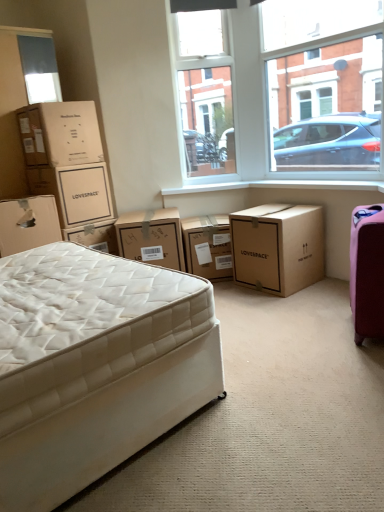
Question: Is white quilted mattress at lower left thinner than white smooth window sill at center?

Choices:
 (A) no
 (B) yes

Answer: (A)

Question: From a real-world perspective, is white quilted mattress at lower left on white smooth window sill at center?

Choices:
 (A) yes
 (B) no

Answer: (B)

Question: From the image's perspective, is white quilted mattress at lower left on top of white smooth window sill at center?

Choices:
 (A) yes
 (B) no

Answer: (B)

Question: Could white smooth window sill at center be considered to be inside white quilted mattress at lower left?

Choices:
 (A) yes
 (B) no

Answer: (B)

Question: Is white quilted mattress at lower left in contact with white smooth window sill at center?

Choices:
 (A) yes
 (B) no

Answer: (B)

Question: From the image's perspective, is white quilted mattress at lower left beneath white smooth window sill at center?

Choices:
 (A) no
 (B) yes

Answer: (B)

Question: Is brown cardboard box at center, the 5th box positioned from the left, smaller than brown cardboard box at upper left, which is the fifth box in right-to-left order?

Choices:
 (A) yes
 (B) no

Answer: (A)

Question: Could you tell me if brown cardboard box at center, placed as the 2th box when sorted from right to left, is facing brown cardboard box at upper left, which is the 2th box in left-to-right order?

Choices:
 (A) no
 (B) yes

Answer: (A)

Question: Is there a large distance between brown cardboard box at center, the 5th box positioned from the left, and brown cardboard box at upper left, which is the 2th box in left-to-right order?

Choices:
 (A) no
 (B) yes

Answer: (B)

Question: From a real-world perspective, does brown cardboard box at center, the 5th box positioned from the left, sit lower than brown cardboard box at upper left, which is the 2th box in left-to-right order?

Choices:
 (A) no
 (B) yes

Answer: (B)

Question: Can you confirm if brown cardboard box at center, the 5th box positioned from the left, is taller than brown cardboard box at upper left, which is the fifth box in right-to-left order?

Choices:
 (A) no
 (B) yes

Answer: (B)

Question: Does brown cardboard box at center, the 5th box positioned from the left, have a lesser width compared to brown cardboard box at upper left, which is the 2th box in left-to-right order?

Choices:
 (A) no
 (B) yes

Answer: (B)

Question: Is matte brown cardboard box at upper left, placed as the 4th box when sorted from right to left, located outside brown cardboard box at upper left, which is the fifth box in right-to-left order?

Choices:
 (A) yes
 (B) no

Answer: (A)